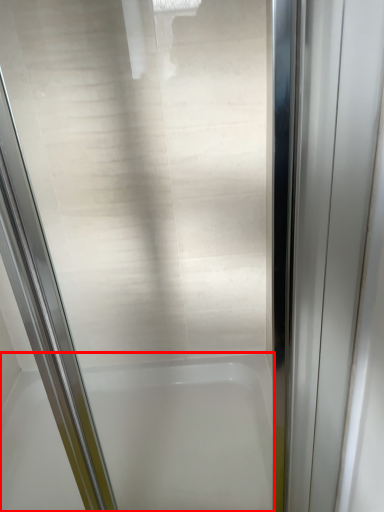
Question: In this image, where is bathtub (annotated by the red box) located relative to elevator door?

Choices:
 (A) right
 (B) left

Answer: (B)